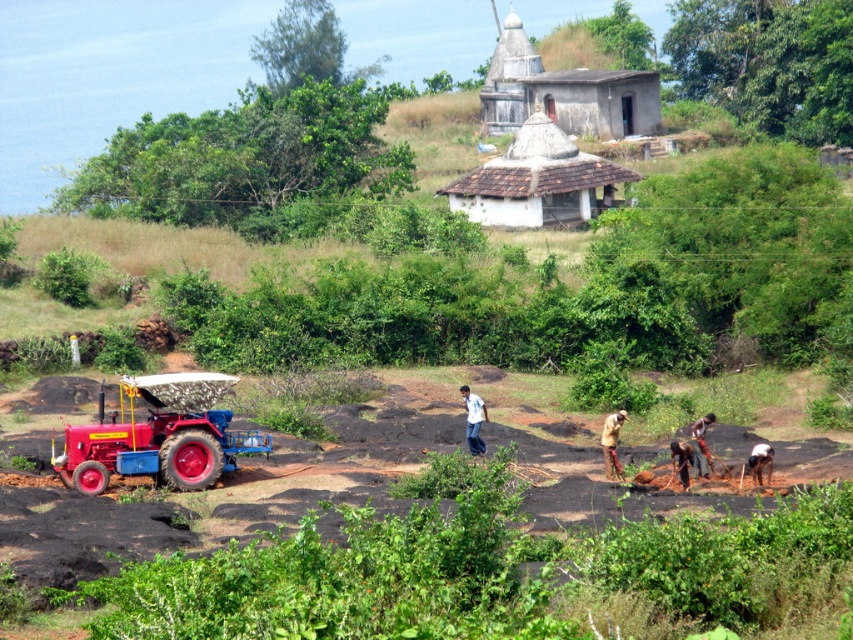
Who is taller, white stucco temple at upper center or brown fabric at lower right?

Standing taller between the two is white stucco temple at upper center.

Does white stucco temple at upper center appear over brown fabric at lower right?

Correct, white stucco temple at upper center is located above brown fabric at lower right.

Is point (590, 116) closer to viewer compared to point (671, 460)?

That is False.

Locate an element on the screen. This screenshot has width=853, height=640. white stucco temple at upper center is located at coordinates (566, 92).

Who is taller, brown fabric shirt at center or dark brown skin at lower right?

With more height is brown fabric shirt at center.

This screenshot has height=640, width=853. I want to click on brown fabric shirt at center, so click(611, 444).

Locate an element on the screen. brown fabric shirt at center is located at coordinates (611, 444).

Can you confirm if brown fabric shirt at center is bigger than brown fabric shirt at lower right?

Correct, brown fabric shirt at center is larger in size than brown fabric shirt at lower right.

Is point (614, 468) in front of point (692, 449)?

No, (614, 468) is behind (692, 449).

Where is `brown fabric shirt at center`? This screenshot has width=853, height=640. brown fabric shirt at center is located at coordinates (611, 444).